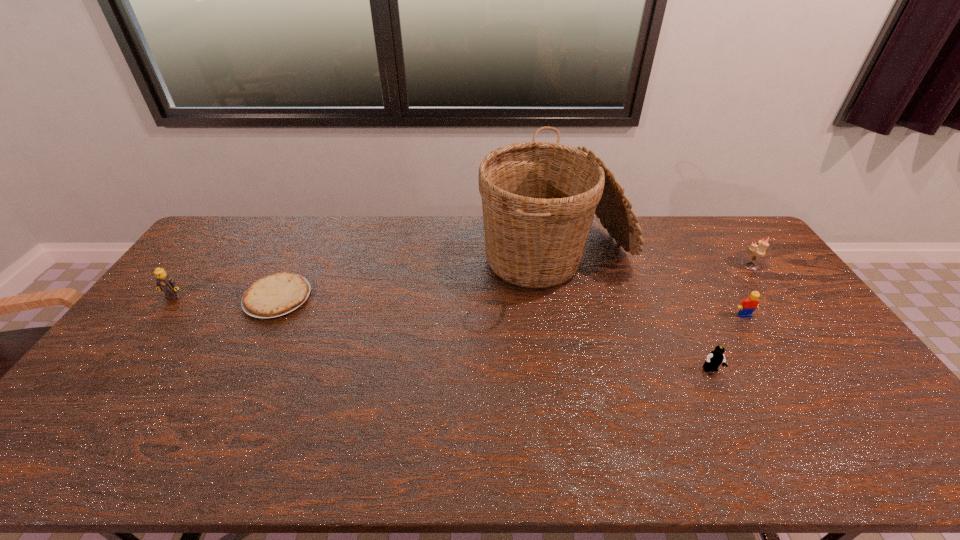
Identify the location of vacant space in between the rightmost Lego and the second object from left to right. (511, 306).

The image size is (960, 540). Find the location of `blank region between the fifth object from left to right and the second Lego from left to right`. blank region between the fifth object from left to right and the second Lego from left to right is located at coordinates (728, 343).

Locate an element on the screen. vacant space that is in between the fifth object from right to left and the fourth object from right to left is located at coordinates (417, 279).

What are the coordinates of `vacant space that's between the shortest object and the nearest object` in the screenshot? It's located at (494, 334).

Image resolution: width=960 pixels, height=540 pixels. In order to click on vacant area that lies between the fourth object from right to left and the shortest object in this screenshot , I will do `click(417, 279)`.

At what (x,y) coordinates should I click in order to perform the action: click on empty space that is in between the fourth object from left to right and the second farthest Lego. Please return your answer as a coordinate pair (x, y). This screenshot has width=960, height=540. Looking at the image, I should click on (728, 343).

Identify which object is the fifth nearest to the second nearest Lego. Please provide its 2D coordinates. Your answer should be formatted as a tuple, i.e. [(x, y)], where the tuple contains the x and y coordinates of a point satisfying the conditions above.

[(164, 282)]

Locate which object ranks fourth in proximity to the fifth object from left to right. Please provide its 2D coordinates. Your answer should be formatted as a tuple, i.e. [(x, y)], where the tuple contains the x and y coordinates of a point satisfying the conditions above.

[(275, 295)]

Identify which Lego is the second nearest to the candle holder. Please provide its 2D coordinates. Your answer should be formatted as a tuple, i.e. [(x, y)], where the tuple contains the x and y coordinates of a point satisfying the conditions above.

[(715, 358)]

Find the location of a particular element. Lego that is the closest to the rightmost Lego is located at coordinates 715,358.